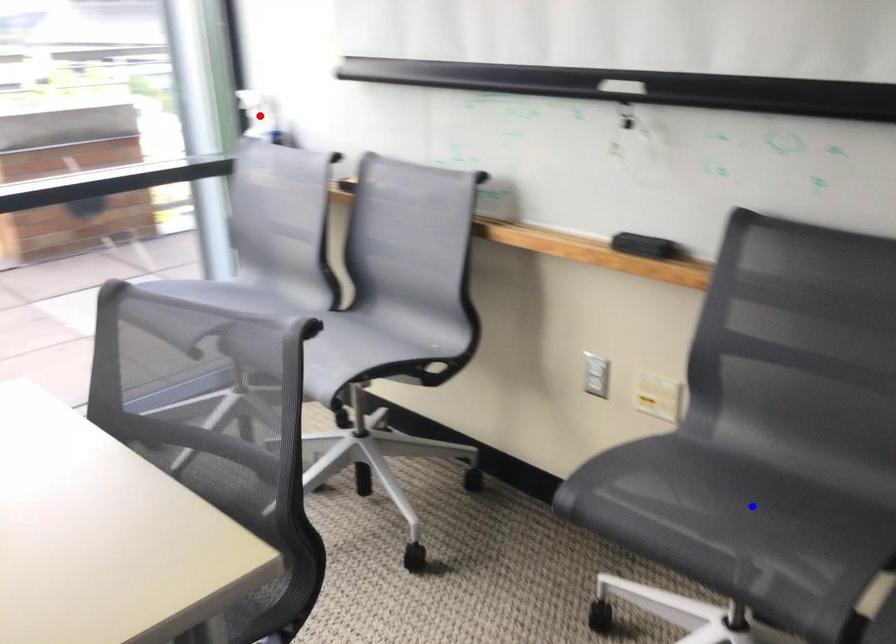
Question: Which of the two points in the image is closer to the camera?

Choices:
 (A) Blue point is closer.
 (B) Red point is closer.

Answer: (A)